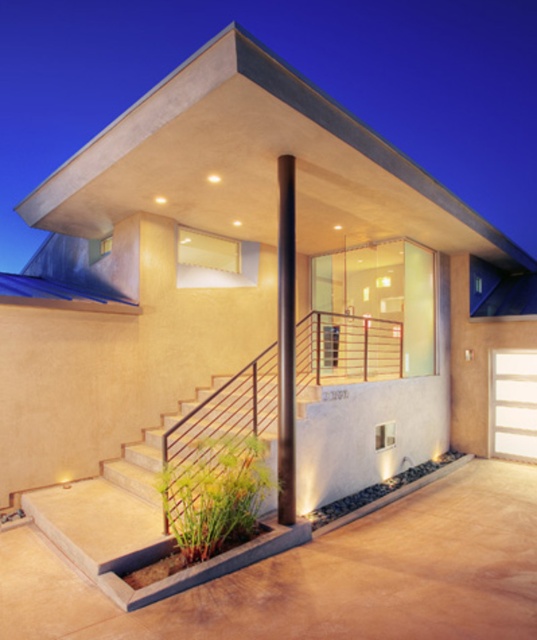
Is black polished pole at center wider than white wood garage door at center?

In fact, black polished pole at center might be narrower than white wood garage door at center.

Does black polished pole at center appear over white wood garage door at center?

Correct, black polished pole at center is located above white wood garage door at center.

Is point (285, 284) positioned after point (505, 392)?

No, (285, 284) is in front of (505, 392).

You are a GUI agent. You are given a task and a screenshot of the screen. Output one action in this format:
    pyautogui.click(x=<x>, y=<y>)
    Task: Click on the black polished pole at center
    Image resolution: width=537 pixels, height=640 pixels.
    Given the screenshot: What is the action you would take?
    pyautogui.click(x=286, y=342)

Between smooth concrete stairs at center and white wood garage door at center, which one appears on the left side from the viewer's perspective?

From the viewer's perspective, smooth concrete stairs at center appears more on the left side.

Does smooth concrete stairs at center appear over white wood garage door at center?

Incorrect, smooth concrete stairs at center is not positioned above white wood garage door at center.

Describe the element at coordinates (108, 509) in the screenshot. I see `smooth concrete stairs at center` at that location.

Locate an element on the screen. The height and width of the screenshot is (640, 537). smooth concrete stairs at center is located at coordinates (108, 509).

Is smooth concrete wall at center above black polished pole at center?

Correct, smooth concrete wall at center is located above black polished pole at center.

Between point (477, 179) and point (291, 403), which one is positioned behind?

Positioned behind is point (477, 179).

Is point (407, 83) closer to camera compared to point (293, 422)?

No, it is not.

Find the location of a particular element. The width and height of the screenshot is (537, 640). smooth concrete wall at center is located at coordinates (292, 70).